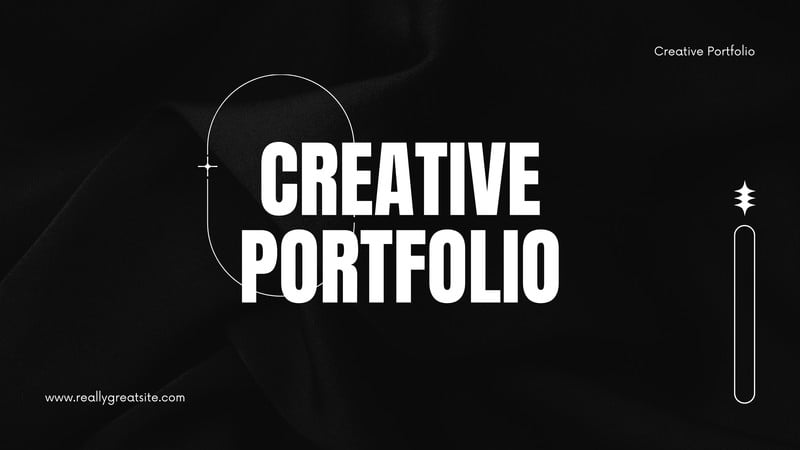
Where is `corner`? This screenshot has height=450, width=800. corner is located at coordinates (782, 17), (26, 47), (17, 433), (785, 437).